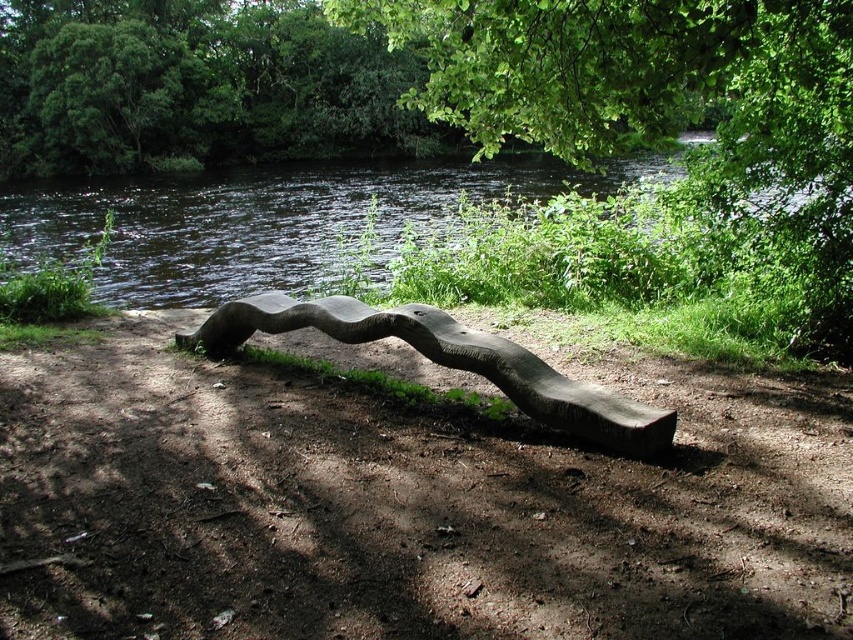
Which is above, green leafy tree at upper center or dark brown wood bench at center?

green leafy tree at upper center is higher up.

Between green leafy tree at upper center and dark brown wood bench at center, which one appears on the right side from the viewer's perspective?

green leafy tree at upper center

Identify the location of green leafy tree at upper center. The width and height of the screenshot is (853, 640). (660, 104).

Can you confirm if green leafy river at center is taller than dark brown wood bench at center?

Yes, green leafy river at center is taller than dark brown wood bench at center.

Is green leafy river at center closer to camera compared to dark brown wood bench at center?

No, it is not.

Between point (430, 179) and point (427, 317), which one is positioned behind?

The point (430, 179) is behind.

You are a GUI agent. You are given a task and a screenshot of the screen. Output one action in this format:
    pyautogui.click(x=<x>, y=<y>)
    Task: Click on the green leafy river at center
    This screenshot has height=640, width=853.
    Given the screenshot: What is the action you would take?
    pyautogui.click(x=262, y=220)

Based on the photo, can you confirm if green leafy tree at upper center is positioned below green leafy river at center?

Actually, green leafy tree at upper center is above green leafy river at center.

Is the position of green leafy tree at upper center more distant than that of green leafy river at center?

That is False.

Does point (740, 56) come behind point (425, 228)?

No, it is not.

Identify the location of green leafy tree at upper center. (660, 104).